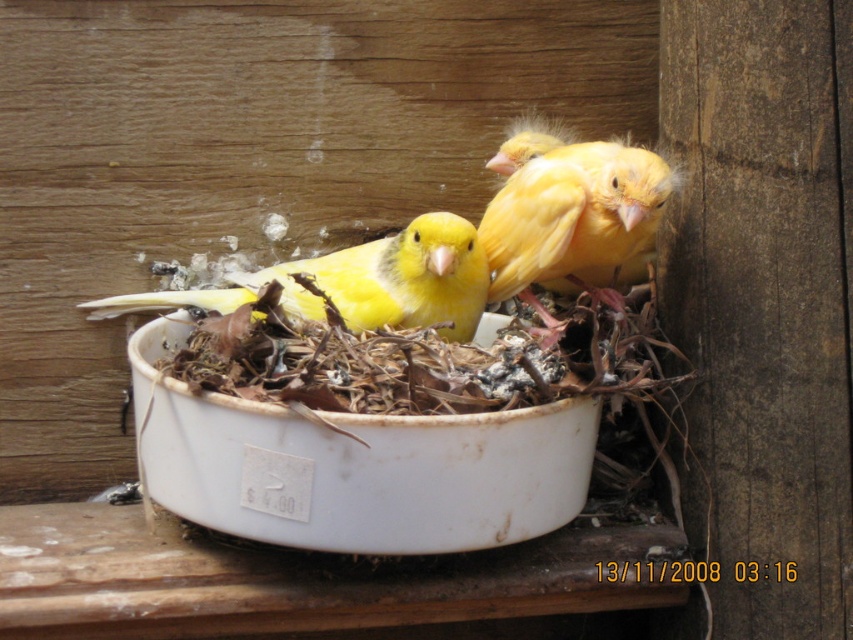
Is yellow matte bird at center to the right of matte yellow canary at center from the viewer's perspective?

Indeed, yellow matte bird at center is positioned on the right side of matte yellow canary at center.

Where is `yellow matte bird at center`? The image size is (853, 640). yellow matte bird at center is located at coordinates (569, 216).

You are a GUI agent. You are given a task and a screenshot of the screen. Output one action in this format:
    pyautogui.click(x=<x>, y=<y>)
    Task: Click on the yellow matte bird at center
    The width and height of the screenshot is (853, 640).
    Given the screenshot: What is the action you would take?
    tap(569, 216)